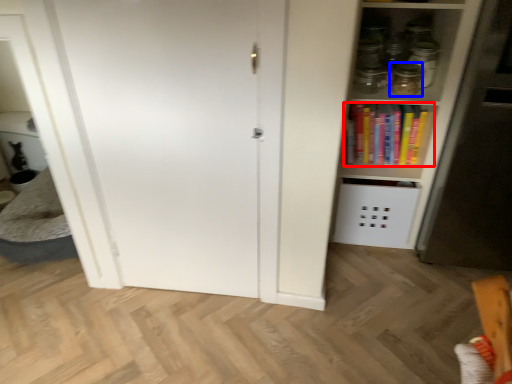
Question: Which point is closer to the camera, book (highlighted by a red box) or glass jar (highlighted by a blue box)?

Choices:
 (A) book
 (B) glass jar

Answer: (B)